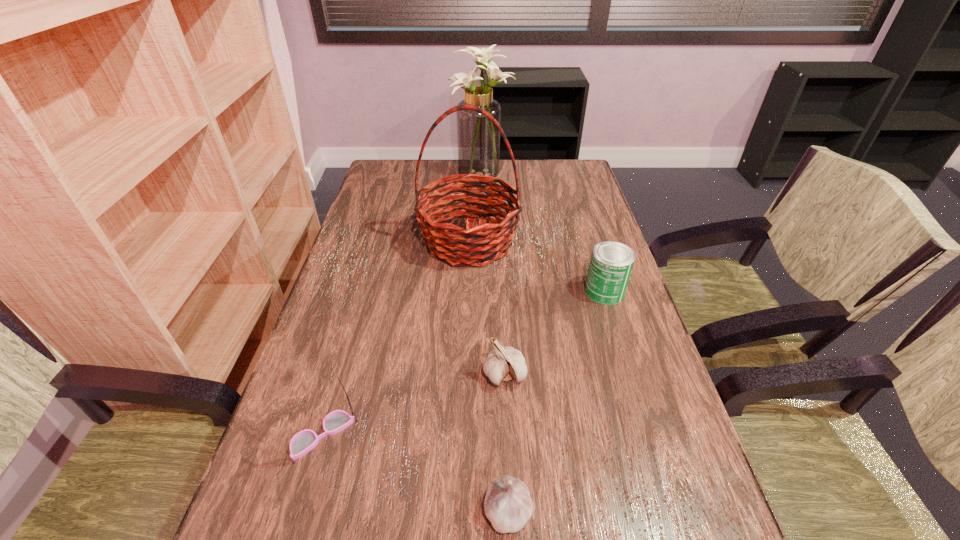
Identify the location of vacant space located 0.350m on the front of the can. Image resolution: width=960 pixels, height=540 pixels. (650, 435).

Find the location of `blank space located on the left of the farther garlic`. blank space located on the left of the farther garlic is located at coordinates (389, 374).

The image size is (960, 540). I want to click on free region located 0.330m on the back of the spectacles, so click(x=363, y=294).

This screenshot has height=540, width=960. I want to click on free space located on the left of the nearest object, so click(266, 510).

Find the location of `object at the far edge`. object at the far edge is located at coordinates (478, 140).

Where is `object at the left edge`? The height and width of the screenshot is (540, 960). object at the left edge is located at coordinates tap(304, 441).

Image resolution: width=960 pixels, height=540 pixels. Find the location of `object that is at the right edge`. object that is at the right edge is located at coordinates (611, 264).

In the image, there is a desktop. What are the coordinates of `vacant space at the far edge` in the screenshot? It's located at (454, 166).

Find the location of a particular element. The image size is (960, 540). vacant space at the left edge of the desktop is located at coordinates (275, 439).

Image resolution: width=960 pixels, height=540 pixels. I want to click on free space at the far left corner of the desktop, so click(x=403, y=159).